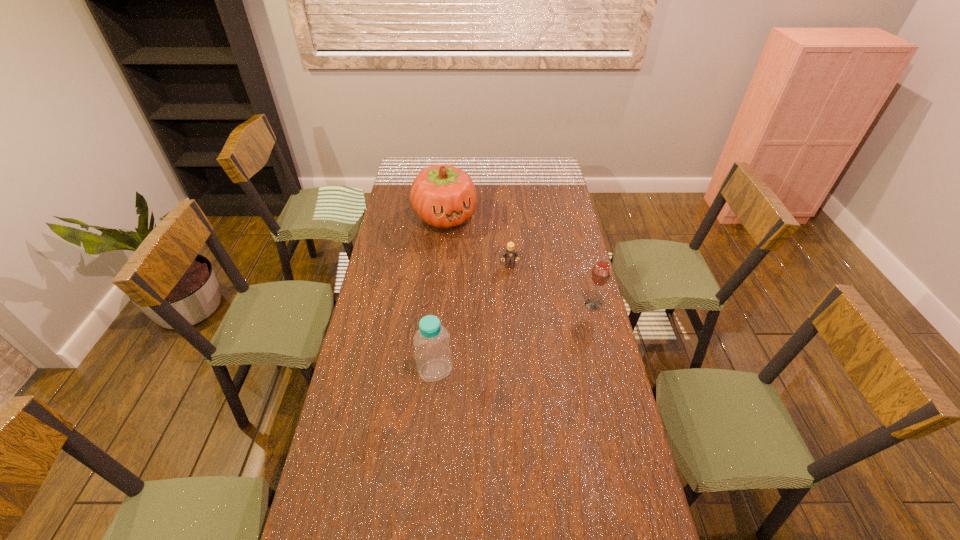
You are a GUI agent. You are given a task and a screenshot of the screen. Output one action in this format:
    pyautogui.click(x=<x>, y=<y>)
    Task: Click on the vacant space on the desktop that is between the bottle and the rightmost object and is positioned on the side of the pumpkin with the cute face
    Image resolution: width=960 pixels, height=540 pixels.
    Given the screenshot: What is the action you would take?
    pyautogui.click(x=514, y=338)

You are a GUI agent. You are given a task and a screenshot of the screen. Output one action in this format:
    pyautogui.click(x=<x>, y=<y>)
    Task: Click on the free space on the desktop that is between the nearest object and the wineglass and is positioned in front of the second object from right to left
    Image resolution: width=960 pixels, height=540 pixels.
    Given the screenshot: What is the action you would take?
    pyautogui.click(x=521, y=334)